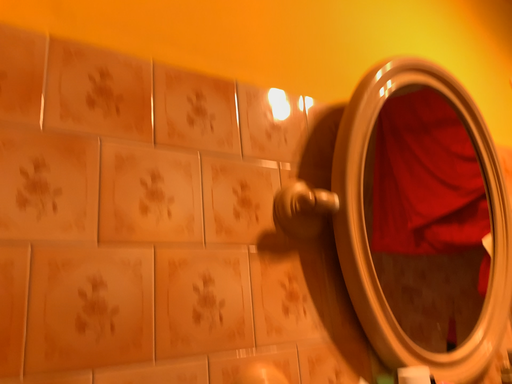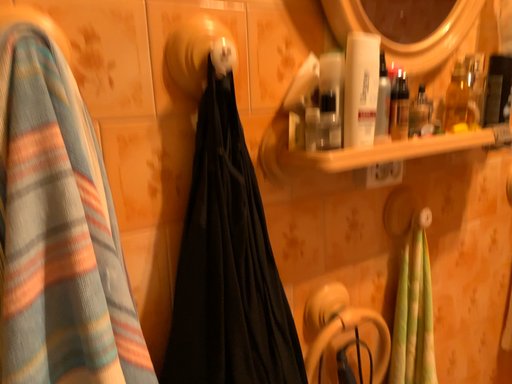
Question: Which way did the camera rotate in the video?

Choices:
 (A) rotated downward
 (B) rotated upward

Answer: (A)